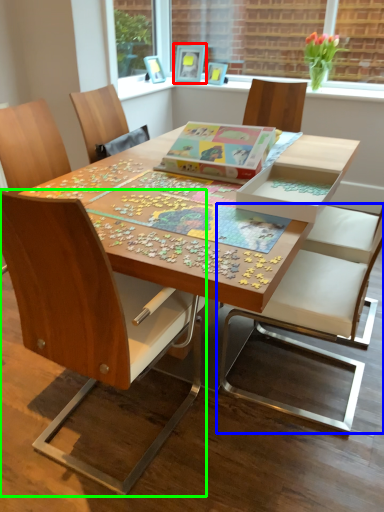
Question: Which is nearer to the picture frame (highlighted by a red box)? chair (highlighted by a blue box) or chair (highlighted by a green box).

Choices:
 (A) chair
 (B) chair

Answer: (A)